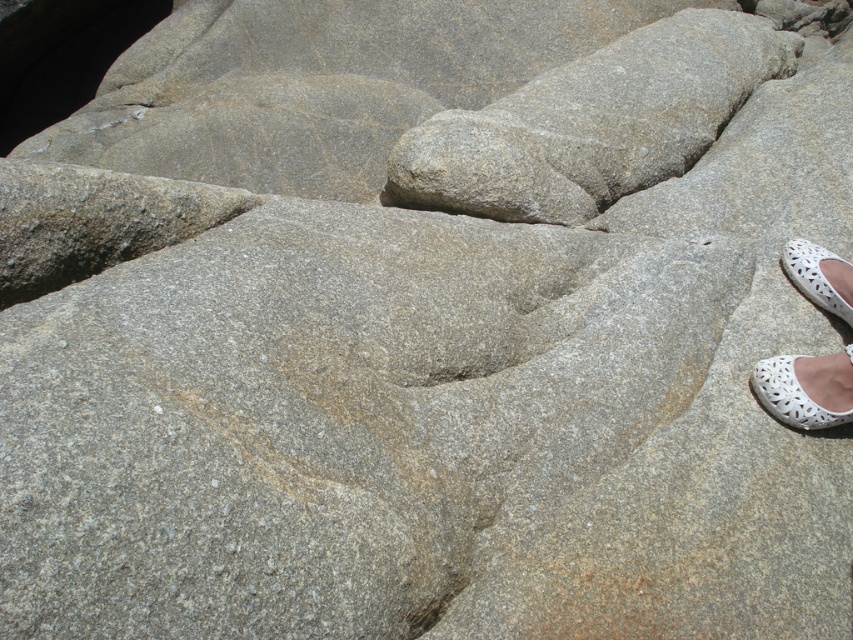
Is white lace shoe at lower right to the right of white mesh shoe at lower right from the viewer's perspective?

In fact, white lace shoe at lower right is to the left of white mesh shoe at lower right.

Image resolution: width=853 pixels, height=640 pixels. In order to click on white lace shoe at lower right in this screenshot , I will do `click(790, 396)`.

Can you confirm if white lace sandal at lower right is wider than white lace shoe at lower right?

Yes.

Is white lace sandal at lower right closer to camera compared to white lace shoe at lower right?

No.

Measure the distance between point (833, 300) and camera.

6.41 feet

This screenshot has height=640, width=853. Find the location of `white lace sandal at lower right`. white lace sandal at lower right is located at coordinates (792, 394).

Who is higher up, white lace sandal at lower right or white mesh shoe at lower right?

Positioned higher is white mesh shoe at lower right.

Which is behind, point (781, 403) or point (813, 280)?

Point (813, 280)

Identify the location of white lace sandal at lower right. (792, 394).